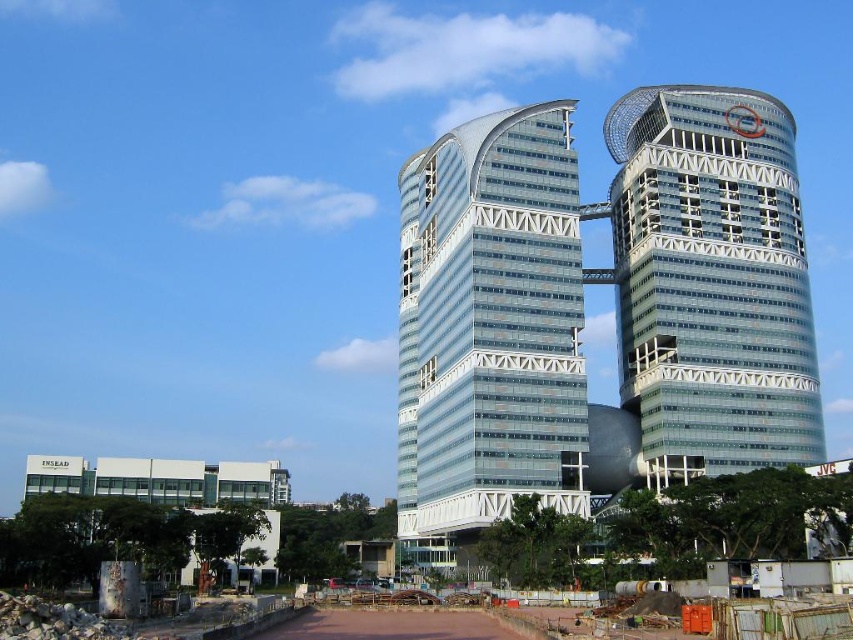
How far apart are transparent glass building at center and transparent glass tower at upper right?

They are 51.95 feet apart.

Is transparent glass building at center to the left of transparent glass tower at upper right from the viewer's perspective?

Yes, transparent glass building at center is to the left of transparent glass tower at upper right.

Is point (531, 109) positioned behind point (752, 189)?

No, it is in front of (752, 189).

The image size is (853, 640). Find the location of `transparent glass building at center`. transparent glass building at center is located at coordinates (489, 328).